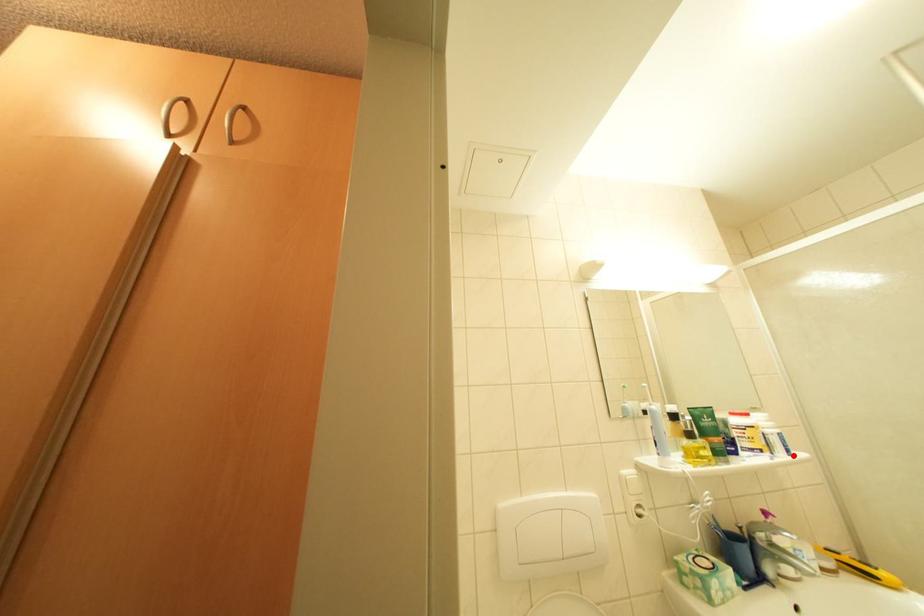
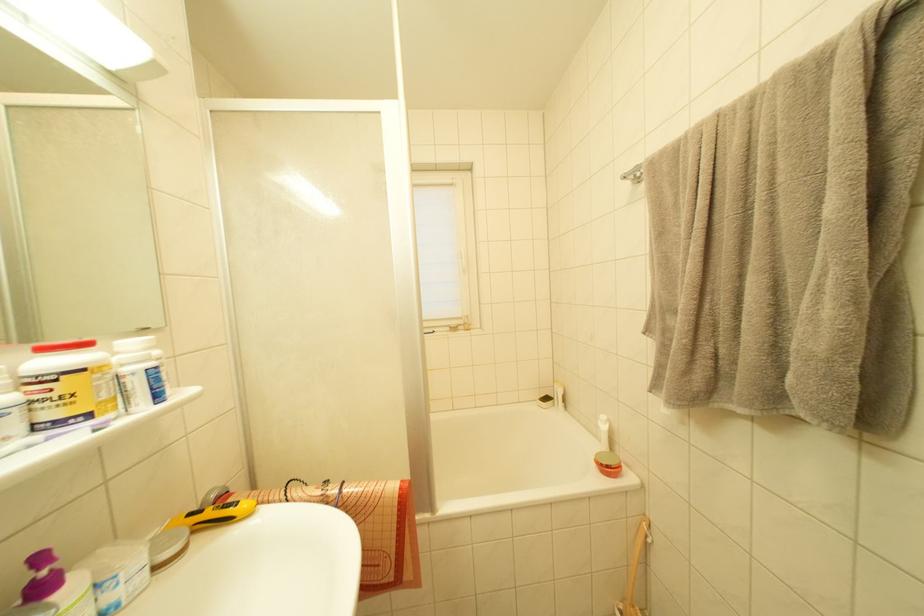
Locate, in the second image, the point that corresponds to the highlighted location in the first image.

(163, 400)